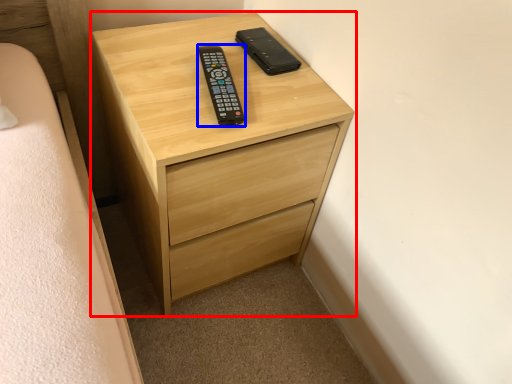
Question: Which point is closer to the camera, chest of drawers (highlighted by a red box) or control (highlighted by a blue box)?

Choices:
 (A) chest of drawers
 (B) control

Answer: (A)